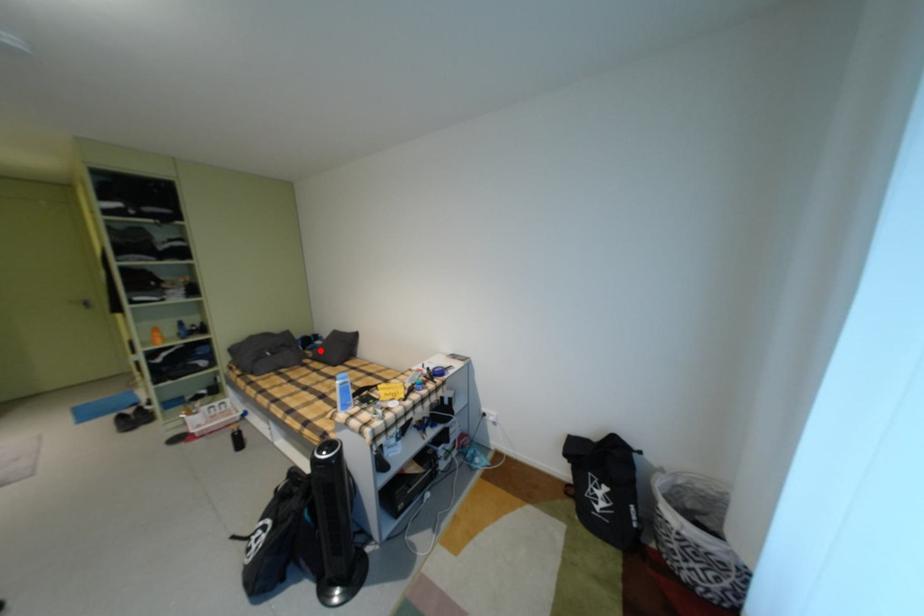
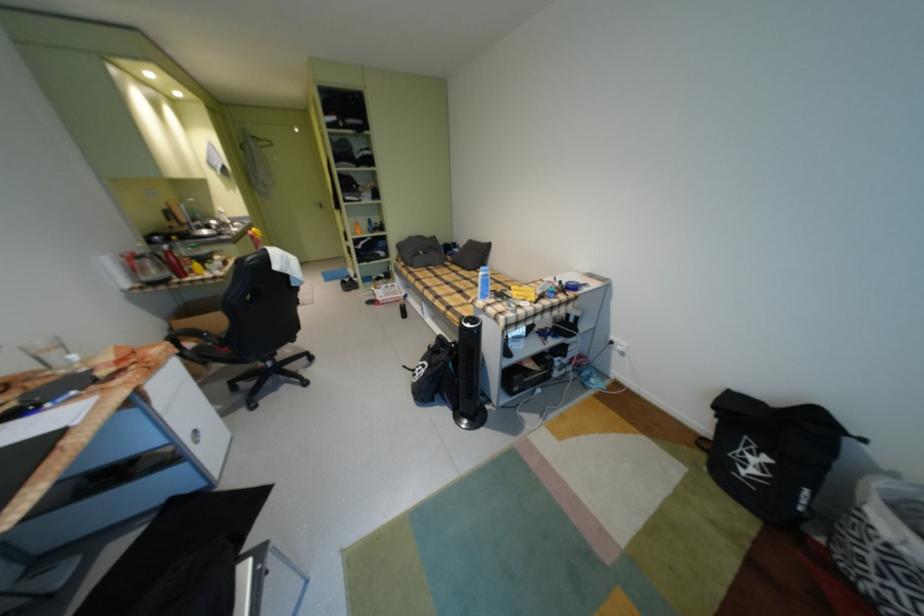
Question: I am providing you with two images of the same scene from different viewpoints. A red point is shown in image1. For the corresponding object point in image2, is it positioned nearer or farther from the camera?

Choices:
 (A) Nearer
 (B) Farther

Answer: (A)